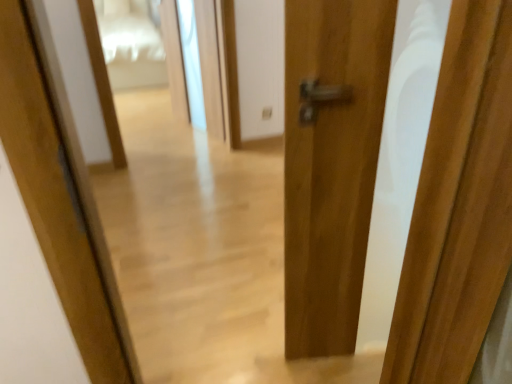
Question: Is matte wood door at center outside of transparent glass screen door at center?

Choices:
 (A) yes
 (B) no

Answer: (A)

Question: Does matte wood door at center have a lesser width compared to transparent glass screen door at center?

Choices:
 (A) no
 (B) yes

Answer: (A)

Question: Does matte wood door at center have a larger size compared to transparent glass screen door at center?

Choices:
 (A) yes
 (B) no

Answer: (A)

Question: From the image's perspective, is matte wood door at center over transparent glass screen door at center?

Choices:
 (A) no
 (B) yes

Answer: (A)

Question: Considering the relative sizes of matte wood door at center and transparent glass screen door at center in the image provided, is matte wood door at center shorter than transparent glass screen door at center?

Choices:
 (A) yes
 (B) no

Answer: (B)

Question: Are matte wood door at center and transparent glass screen door at center located far from each other?

Choices:
 (A) no
 (B) yes

Answer: (B)

Question: From the image's perspective, does transparent glass screen door at center appear lower than matte wood door at center?

Choices:
 (A) yes
 (B) no

Answer: (B)

Question: Is transparent glass screen door at center behind matte wood door at center?

Choices:
 (A) yes
 (B) no

Answer: (A)

Question: Is transparent glass screen door at center aimed at matte wood door at center?

Choices:
 (A) no
 (B) yes

Answer: (B)

Question: Is transparent glass screen door at center bigger than matte wood door at center?

Choices:
 (A) no
 (B) yes

Answer: (A)

Question: Is transparent glass screen door at center not inside matte wood door at center?

Choices:
 (A) yes
 (B) no

Answer: (A)

Question: Is transparent glass screen door at center shorter than matte wood door at center?

Choices:
 (A) yes
 (B) no

Answer: (A)

Question: From their relative heights in the image, would you say transparent glass screen door at center is taller or shorter than matte wood door at center?

Choices:
 (A) tall
 (B) short

Answer: (B)